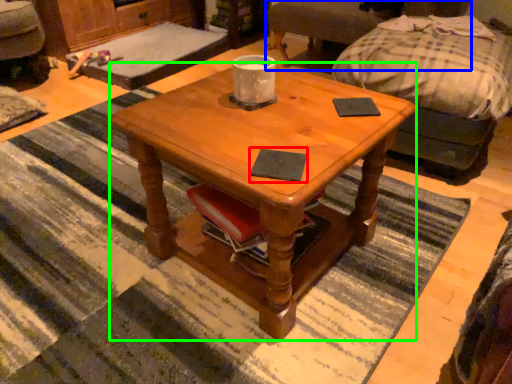
Question: Which is farther away from pad (highlighted by a red box)? swivel chair (highlighted by a blue box) or coffee table (highlighted by a green box)?

Choices:
 (A) swivel chair
 (B) coffee table

Answer: (A)